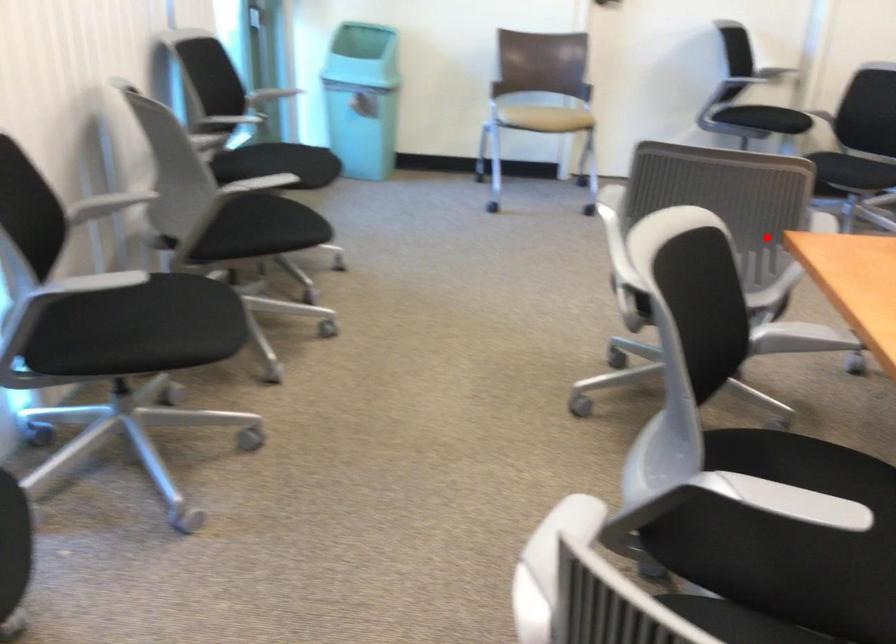
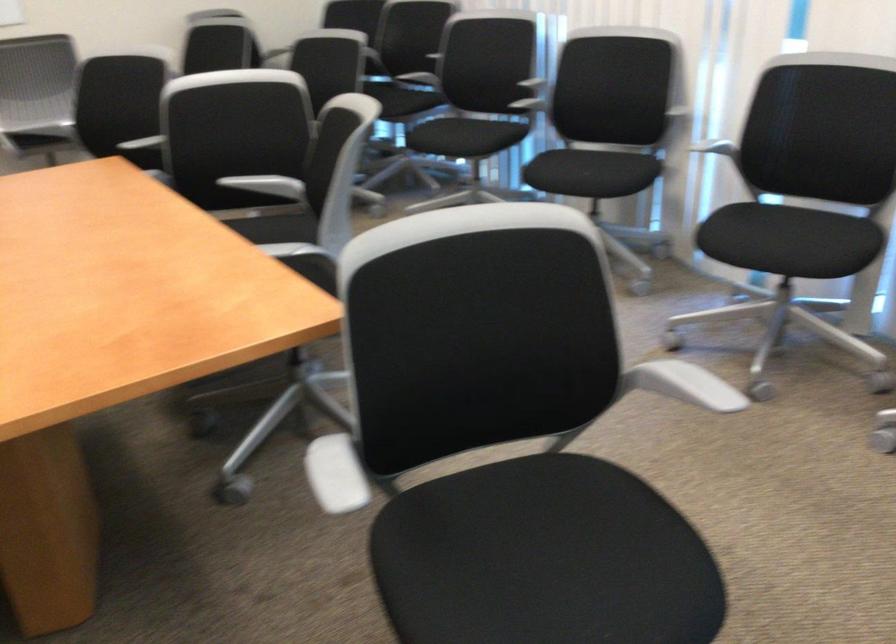
The point at the highlighted location is marked in the first image. Where is the corresponding point in the second image?

(334, 474)